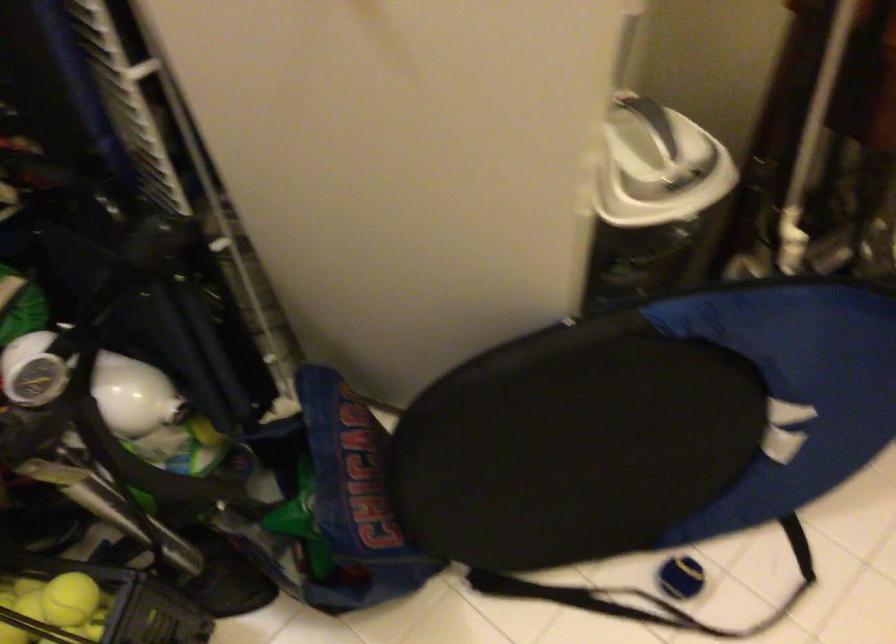
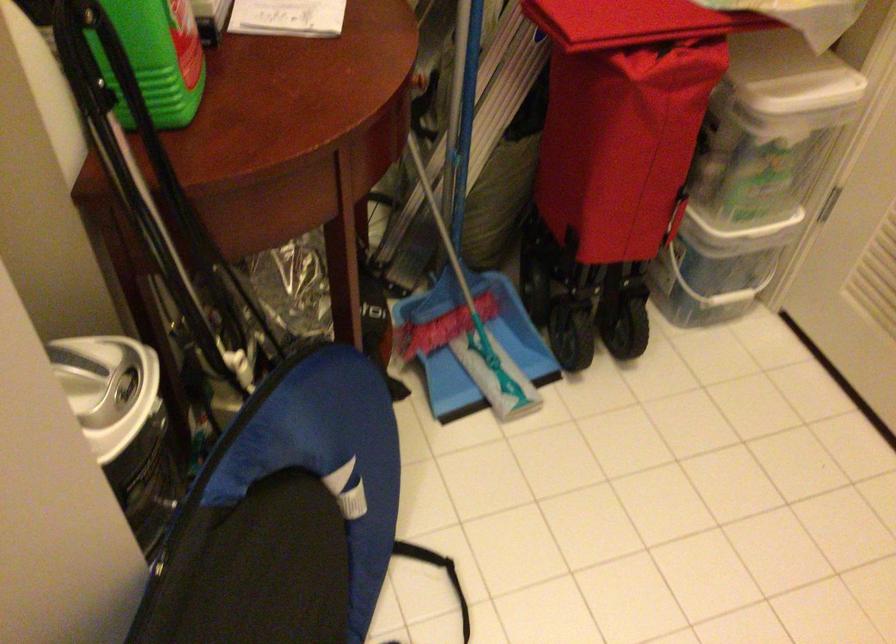
Where in the second image is the point corresponding to [664,169] from the first image?

(107, 388)